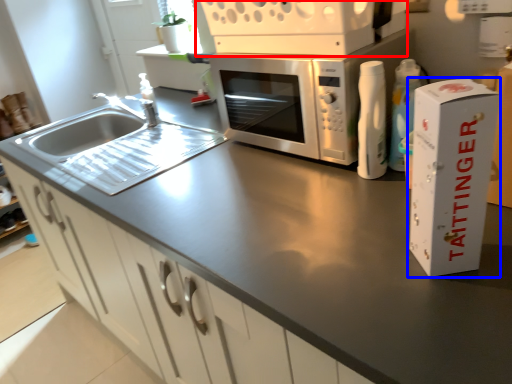
Question: Which object is further to the camera taking this photo, appliance (highlighted by a red box) or cardboard box (highlighted by a blue box)?

Choices:
 (A) appliance
 (B) cardboard box

Answer: (A)